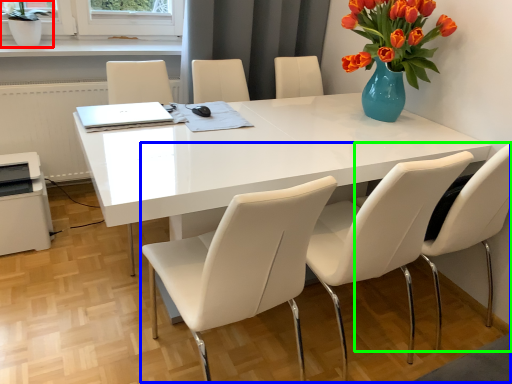
Question: Considering the real-world distances, which object is farthest from houseplant (highlighted by a red box)? trio (highlighted by a blue box) or chair (highlighted by a green box)?

Choices:
 (A) trio
 (B) chair

Answer: (B)